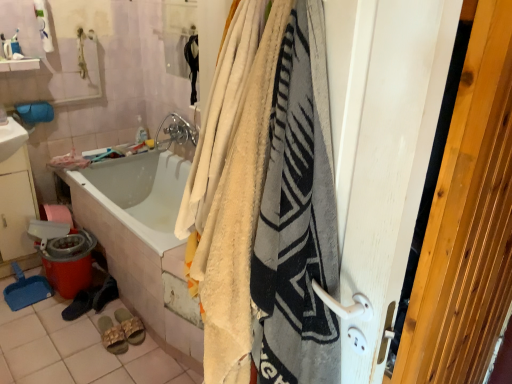
Describe the element at coordinates (175, 132) in the screenshot. The width and height of the screenshot is (512, 384). I see `chrome metallic faucet at upper center` at that location.

Describe the element at coordinates (274, 217) in the screenshot. I see `soft cotton blanket at center` at that location.

Measure the distance between black suede shoes at lower left, which ranks as the 2th footwear in left-to-right order, and camera.

black suede shoes at lower left, which ranks as the 2th footwear in left-to-right order, and camera are 2.26 meters apart from each other.

The width and height of the screenshot is (512, 384). I want to click on black fabric shoe at lower left, positioned as the fourth footwear in right-to-left order, so click(91, 299).

This screenshot has height=384, width=512. Describe the element at coordinates (112, 336) in the screenshot. I see `gold fabric slippers at lower center, positioned as the 3th footwear in left-to-right order` at that location.

Identify the location of white plastic soap at upper center. The image size is (512, 384). (141, 131).

Locate an element on the screen. The width and height of the screenshot is (512, 384). chrome metallic faucet at upper center is located at coordinates click(x=175, y=132).

Does point (121, 330) come behind point (327, 231)?

Yes, point (121, 330) is behind point (327, 231).

Considering the sizes of objects gold fabric slippers at lower center, acting as the 2th footwear starting from the right, and soft cotton blanket at center in the image provided, who is taller, gold fabric slippers at lower center, acting as the 2th footwear starting from the right, or soft cotton blanket at center?

With more height is soft cotton blanket at center.

Would you consider gold fabric slippers at lower center, acting as the 2th footwear starting from the right, to be distant from soft cotton blanket at center?

gold fabric slippers at lower center, acting as the 2th footwear starting from the right, is positioned a significant distance from soft cotton blanket at center.

From the image's perspective, is gold fabric slippers at lower center, positioned as the 3th footwear in left-to-right order, beneath soft cotton blanket at center?

Yes.

From a real-world perspective, is gold fabric slippers at lower center, acting as the 2th footwear starting from the right, under white glossy sink at upper left, which is the 2th sink from bottom to top?

Yes, from a real-world perspective, gold fabric slippers at lower center, acting as the 2th footwear starting from the right, is under white glossy sink at upper left, which is the 2th sink from bottom to top.

Which is behind, point (110, 321) or point (3, 126)?

The point (3, 126) is behind.

Considering the relative positions of gold fabric slippers at lower center, positioned as the 3th footwear in left-to-right order, and white glossy sink at upper left, which is the 2th sink from bottom to top, in the image provided, is gold fabric slippers at lower center, positioned as the 3th footwear in left-to-right order, to the left of white glossy sink at upper left, which is the 2th sink from bottom to top, from the viewer's perspective?

No, gold fabric slippers at lower center, positioned as the 3th footwear in left-to-right order, is not to the left of white glossy sink at upper left, which is the 2th sink from bottom to top.

Considering the relative sizes of gold fabric slippers at lower center, acting as the 2th footwear starting from the right, and white glossy sink at upper left, marked as the 1th sink in a top-to-bottom arrangement, in the image provided, is gold fabric slippers at lower center, acting as the 2th footwear starting from the right, bigger than white glossy sink at upper left, marked as the 1th sink in a top-to-bottom arrangement,?

Actually, gold fabric slippers at lower center, acting as the 2th footwear starting from the right, might be smaller than white glossy sink at upper left, marked as the 1th sink in a top-to-bottom arrangement.

From their relative heights in the image, would you say white tile at lower left is taller or shorter than soft cotton blanket at center?

Considering their sizes, white tile at lower left has less height than soft cotton blanket at center.

At what (x,y) coordinates should I click in order to perform the action: click on blanket in front of the white tile at lower left. Please return your answer as a coordinate pair (x, y). Image resolution: width=512 pixels, height=384 pixels. Looking at the image, I should click on (274, 217).

Is white tile at lower left positioned far away from soft cotton blanket at center?

Yes, white tile at lower left is far from soft cotton blanket at center.

Could you tell me if white wood screen door at right is turned towards black suede shoes at lower left, which ranks as the 2th footwear in left-to-right order?

No, white wood screen door at right is not turned towards black suede shoes at lower left, which ranks as the 2th footwear in left-to-right order.

Considering the positions of points (379, 119) and (96, 293), is point (379, 119) farther from camera compared to point (96, 293)?

No.

Looking at the image, does white wood screen door at right seem bigger or smaller compared to black suede shoes at lower left, which ranks as the 2th footwear in left-to-right order?

Clearly, white wood screen door at right is larger in size than black suede shoes at lower left, which ranks as the 2th footwear in left-to-right order.

From the image's perspective, between white wood screen door at right and black suede shoes at lower left, which ranks as the 2th footwear in left-to-right order, who is located below?

From the image's view, black suede shoes at lower left, which ranks as the 2th footwear in left-to-right order, is below.

From a real-world perspective, which is physically above, white glossy sink at upper left, which is the 2th sink from bottom to top, or gold fabric slippers at lower center, acting as the 2th footwear starting from the right?

white glossy sink at upper left, which is the 2th sink from bottom to top, from a real-world perspective.

Considering the relative sizes of white glossy sink at upper left, marked as the 1th sink in a top-to-bottom arrangement, and gold fabric slippers at lower center, acting as the 2th footwear starting from the right, in the image provided, is white glossy sink at upper left, marked as the 1th sink in a top-to-bottom arrangement, shorter than gold fabric slippers at lower center, acting as the 2th footwear starting from the right,?

In fact, white glossy sink at upper left, marked as the 1th sink in a top-to-bottom arrangement, may be taller than gold fabric slippers at lower center, acting as the 2th footwear starting from the right.

From the image's perspective, is white glossy sink at upper left, marked as the 1th sink in a top-to-bottom arrangement, located above gold fabric slippers at lower center, acting as the 2th footwear starting from the right?

Yes, from the image's perspective, white glossy sink at upper left, marked as the 1th sink in a top-to-bottom arrangement, is above gold fabric slippers at lower center, acting as the 2th footwear starting from the right.

Consider the image. In terms of size, does white glossy sink at upper left, which is the 2th sink from bottom to top, appear bigger or smaller than gold fabric slippers at lower center, acting as the 2th footwear starting from the right?

Clearly, white glossy sink at upper left, which is the 2th sink from bottom to top, is larger in size than gold fabric slippers at lower center, acting as the 2th footwear starting from the right.

Is white tile at lower left wider than black fabric shoe at lower left, positioned as the fourth footwear in right-to-left order?

Yes, white tile at lower left is wider than black fabric shoe at lower left, positioned as the fourth footwear in right-to-left order.

Consider the image. Can you confirm if white tile at lower left is smaller than black fabric shoe at lower left, the 1th footwear from the left?

Actually, white tile at lower left might be larger than black fabric shoe at lower left, the 1th footwear from the left.

At what (x,y) coordinates should I click in order to perform the action: click on the 3rd footwear behind the white tile at lower left, counting from the anchor's position. Please return your answer as a coordinate pair (x, y). This screenshot has width=512, height=384. Looking at the image, I should click on tap(91, 299).

Is white tile at lower left beside gold fabric slippers at lower center, positioned as the 3th footwear in left-to-right order?

No, white tile at lower left is not touching gold fabric slippers at lower center, positioned as the 3th footwear in left-to-right order.

What's the angular difference between white tile at lower left and gold fabric slippers at lower center, acting as the 2th footwear starting from the right,'s facing directions?

The angular difference between white tile at lower left and gold fabric slippers at lower center, acting as the 2th footwear starting from the right, is 3.81 degrees.

Is gold fabric slippers at lower center, positioned as the 3th footwear in left-to-right order, at the back of white tile at lower left?

That's not correct — white tile at lower left is not looking away from gold fabric slippers at lower center, positioned as the 3th footwear in left-to-right order.

Between white tile at lower left and gold fabric slippers at lower center, positioned as the 3th footwear in left-to-right order, which one appears on the left side from the viewer's perspective?

From the viewer's perspective, white tile at lower left appears more on the left side.

There is a soft cotton blanket at center. Identify the location of the 4th footwear below it (from a real-world perspective). This screenshot has width=512, height=384. (x=112, y=336).

At what (x,y) coordinates should I click in order to perform the action: click on the 1st sink to the left when counting from the gold fabric slippers at lower center, positioned as the 3th footwear in left-to-right order. Please return your answer as a coordinate pair (x, y). The height and width of the screenshot is (384, 512). Looking at the image, I should click on (11, 138).

When comparing their distances from black fabric shoe at lower left, the 1th footwear from the left, does beige fabric slipper at lower center, the 1th footwear when ordered from right to left, or gold fabric slippers at lower center, positioned as the 3th footwear in left-to-right order, seem further?

beige fabric slipper at lower center, the 1th footwear when ordered from right to left, is positioned further to the anchor black fabric shoe at lower left, the 1th footwear from the left.

Looking at the image, which one is located closer to gold fabric slippers at lower center, positioned as the 3th footwear in left-to-right order, white plastic soap at upper center or white glossy bathtub at lower left?

white glossy bathtub at lower left lies closer to gold fabric slippers at lower center, positioned as the 3th footwear in left-to-right order, than the other object.

From the picture: Based on their spatial positions, is white wood screen door at right or white glossy sink at lower left, placed as the 1th sink when sorted from bottom to top, further from white glossy sink at upper left, which is the 2th sink from bottom to top?

white wood screen door at right is positioned further to the anchor white glossy sink at upper left, which is the 2th sink from bottom to top.

Which object lies further to the anchor point white glossy sink at lower left, placed as the 1th sink when sorted from bottom to top, white wood screen door at right or soft cotton blanket at center?

white wood screen door at right is further to white glossy sink at lower left, placed as the 1th sink when sorted from bottom to top.

Looking at the image, which one is located closer to soft cotton blanket at center, chrome metallic faucet at upper center or beige fabric slipper at lower center, the fourth footwear in the left-to-right sequence?

beige fabric slipper at lower center, the fourth footwear in the left-to-right sequence, lies closer to soft cotton blanket at center than the other object.

Estimate the real-world distances between objects in this image. Which object is closer to soft cotton blanket at center, white glossy bathtub at lower left or beige fabric slipper at lower center, the 1th footwear when ordered from right to left?

The object closer to soft cotton blanket at center is white glossy bathtub at lower left.

When comparing their distances from gold fabric slippers at lower center, acting as the 2th footwear starting from the right, does black suede shoes at lower left, which ranks as the 2th footwear in left-to-right order, or white glossy sink at lower left, placed as the 1th sink when sorted from bottom to top, seem further?

Based on the image, white glossy sink at lower left, placed as the 1th sink when sorted from bottom to top, appears to be further to gold fabric slippers at lower center, acting as the 2th footwear starting from the right.

Estimate the real-world distances between objects in this image. Which object is further from black suede shoes at lower left, which is counted as the third footwear, starting from the right, gold fabric slippers at lower center, acting as the 2th footwear starting from the right, or white glossy sink at lower left, placed as the 1th sink when sorted from bottom to top?

white glossy sink at lower left, placed as the 1th sink when sorted from bottom to top, lies further to black suede shoes at lower left, which is counted as the third footwear, starting from the right, than the other object.

The image size is (512, 384). Find the location of `bath situated between white glossy sink at upper left, marked as the 1th sink in a top-to-bottom arrangement, and white wood screen door at right from left to right`. bath situated between white glossy sink at upper left, marked as the 1th sink in a top-to-bottom arrangement, and white wood screen door at right from left to right is located at coordinates (142, 239).

Where is `faucet between soft cotton blanket at center and white plastic soap at upper center in the front-back direction`? faucet between soft cotton blanket at center and white plastic soap at upper center in the front-back direction is located at coordinates (175, 132).

Identify the location of blanket located between white glossy sink at upper left, which is the 2th sink from bottom to top, and white wood screen door at right in the left-right direction. Image resolution: width=512 pixels, height=384 pixels. (274, 217).

Find the location of a particular element. Image resolution: width=512 pixels, height=384 pixels. footwear that lies between chrome metallic faucet at upper center and black fabric shoe at lower left, the 1th footwear from the left, from top to bottom is located at coordinates pyautogui.click(x=105, y=294).